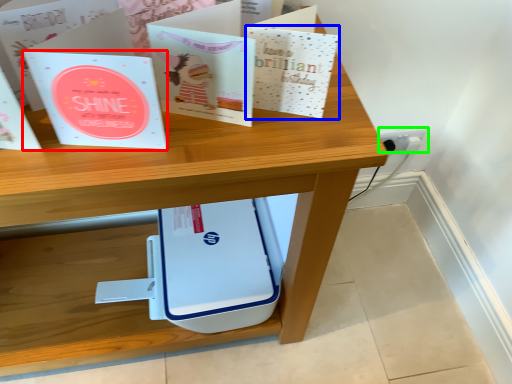
Question: Which object is the farthest from paperback book (highlighted by a red box)? Choose among these: paperback book (highlighted by a blue box) or electric outlet (highlighted by a green box).

Choices:
 (A) paperback book
 (B) electric outlet

Answer: (B)